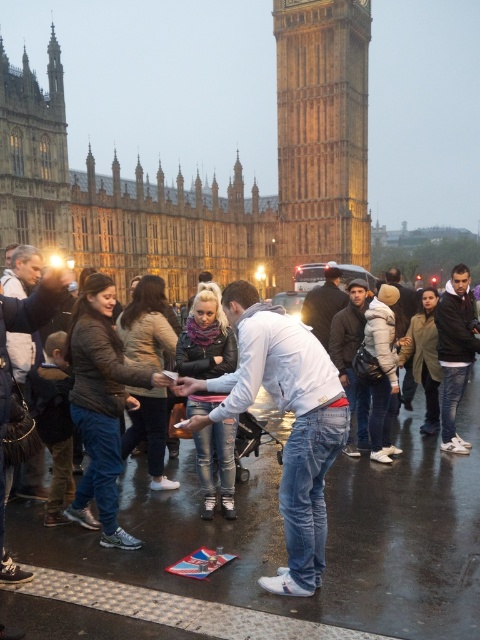
You are standing in front of Big Ben and see a man wearing ripped denim jeans at center and a white fleece jacket at center. Which piece of clothing is closer to you?

The ripped denim jeans at center is closer to the viewer than the white fleece jacket at center.

You are a tourist standing in front of Big Ben and you see the denim jacket at center and the green wool coat at center. Which one is closer to you?

The denim jacket at center is closer to you because it is in front of the green wool coat at center.

You are a photographer standing in front of Big Ben. You see a man in a denim jacket at center and a person in a green wool coat at center. Which clothing item is located to the left of the other?

The denim jacket at center is positioned on the left side of green wool coat at center.